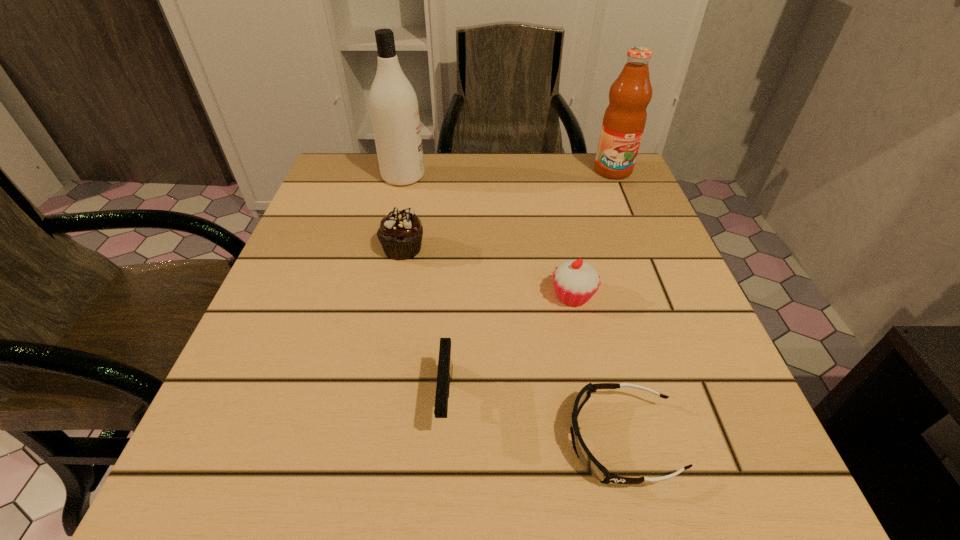
Identify the location of vacant space at the far left corner of the desktop. (383, 197).

I want to click on vacant space at the far right corner of the desktop, so click(603, 201).

Where is `vacant space at the near right corner of the desktop`? Image resolution: width=960 pixels, height=540 pixels. vacant space at the near right corner of the desktop is located at coordinates (735, 450).

This screenshot has height=540, width=960. Identify the location of free space between the right cupcake and the goggles. (597, 368).

In order to click on unoccupied position between the nearer cupcake and the fruit juice in this screenshot , I will do `click(593, 233)`.

Identify the location of blank region between the fifth shortest object and the goggles. The height and width of the screenshot is (540, 960). (616, 305).

You are a GUI agent. You are given a task and a screenshot of the screen. Output one action in this format:
    pyautogui.click(x=<x>, y=<y>)
    Task: Click on the vacant area that lies between the shampoo and the nearer cupcake
    
    Given the screenshot: What is the action you would take?
    pyautogui.click(x=489, y=237)

The height and width of the screenshot is (540, 960). Find the location of `empty location between the nearer cupcake and the shampoo`. empty location between the nearer cupcake and the shampoo is located at coordinates (489, 237).

At what (x,y) coordinates should I click in order to perform the action: click on vacant area between the third nearest object and the shampoo. Please return your answer as a coordinate pair (x, y). The height and width of the screenshot is (540, 960). Looking at the image, I should click on (489, 237).

This screenshot has height=540, width=960. In order to click on free space between the pistol and the nearer cupcake in this screenshot , I will do `click(510, 348)`.